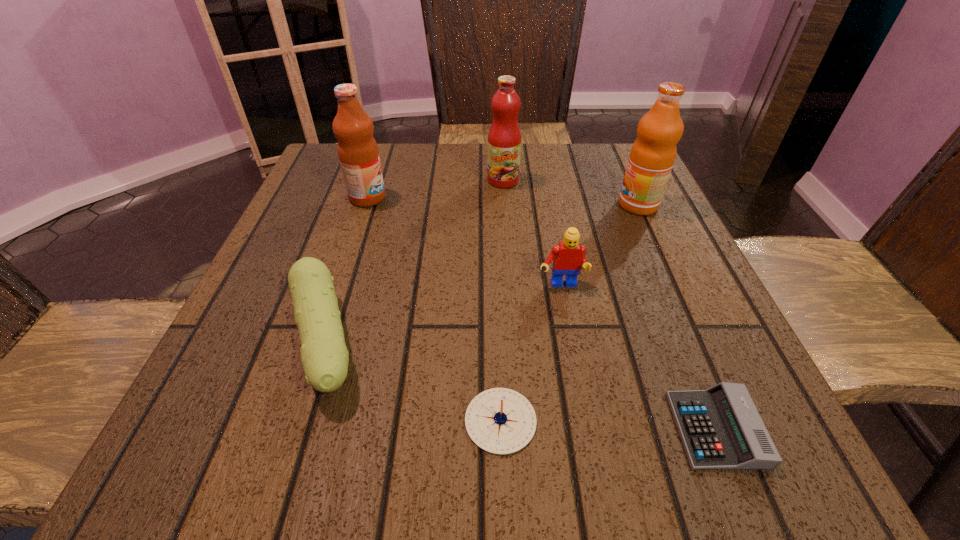
Image resolution: width=960 pixels, height=540 pixels. Identify the location of the rightmost fruit juice. (652, 156).

I want to click on the leftmost fruit juice, so click(358, 153).

Where is `the second fruit juice from right to left`? the second fruit juice from right to left is located at coordinates (504, 138).

The width and height of the screenshot is (960, 540). What are the coordinates of `the fourth tallest object` in the screenshot? It's located at (568, 256).

Locate an element on the screen. This screenshot has width=960, height=540. Lego is located at coordinates (568, 256).

Where is `the fifth tallest object`? This screenshot has width=960, height=540. the fifth tallest object is located at coordinates pos(324,356).

This screenshot has width=960, height=540. I want to click on compass, so click(x=501, y=421).

I want to click on calculator, so click(x=721, y=429).

Find the location of a particular element. free space located 0.130m on the label side of the rightmost fruit juice is located at coordinates (558, 205).

You are a GUI agent. You are given a task and a screenshot of the screen. Output one action in this format:
    pyautogui.click(x=<x>, y=<y>)
    Task: Click on the blank space located 0.390m on the label side of the rightmost fruit juice
    The image size is (960, 540).
    Given the screenshot: What is the action you would take?
    pyautogui.click(x=437, y=205)